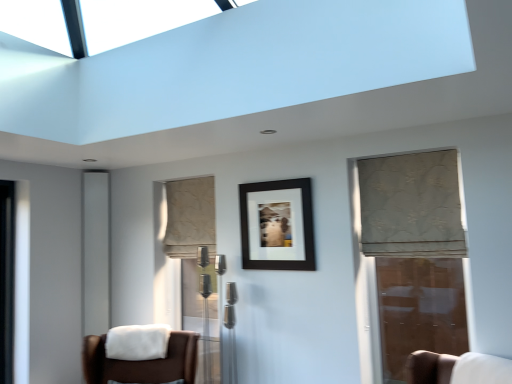
Question: From the image's perspective, is transparent glass door at right positioned above or below beige textured curtain at center, the 1th curtain viewed from the back?

Choices:
 (A) above
 (B) below

Answer: (B)

Question: In terms of size, does transparent glass door at right appear bigger or smaller than beige textured curtain at center, the 2th curtain when ordered from front to back?

Choices:
 (A) small
 (B) big

Answer: (A)

Question: Estimate the real-world distances between objects in this image. Which object is farther from the beige floral fabric curtain at right, arranged as the 1th curtain when viewed from the front?

Choices:
 (A) white fabric chair at lower right, which is counted as the 2th chair, starting from the left
 (B) brown leather chair at lower left, placed as the 1th chair when sorted from left to right
 (C) transparent glass door at right
 (D) gray matte screen door at left
 (E) white soft fabric at lower left

Answer: (D)

Question: Based on their relative distances, which object is farther from the beige floral fabric curtain at right, positioned as the first curtain in right-to-left order?

Choices:
 (A) beige textured curtain at center, the first curtain viewed from the left
 (B) gray matte screen door at left
 (C) white soft fabric at lower left
 (D) black matte picture frame at center
 (E) white fabric chair at lower right, which is counted as the 2th chair, starting from the left

Answer: (B)